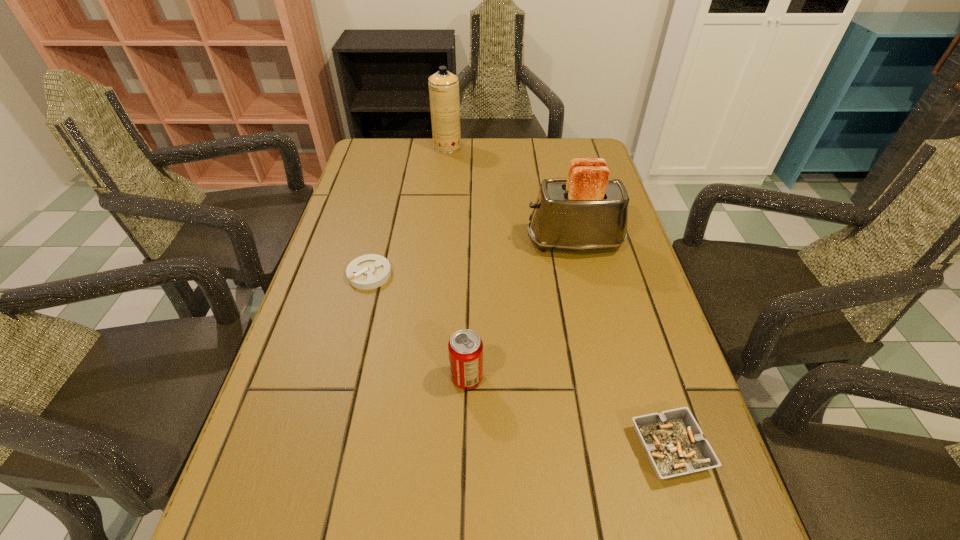
Find the location of `free region at the far edge of the desktop`. free region at the far edge of the desktop is located at coordinates (462, 150).

Image resolution: width=960 pixels, height=540 pixels. In the image, there is a desktop. In order to click on vacant space at the left edge in this screenshot , I will do `click(296, 401)`.

Find the location of a particular element. vacant space at the right edge of the desktop is located at coordinates (678, 510).

Identify the location of free location at the far right corner of the desktop. (585, 154).

Find the location of a particular element. empty space that is in between the aerosol can and the toaster is located at coordinates (511, 194).

Identify the location of free space between the nearer ashtray and the toaster. (622, 346).

Image resolution: width=960 pixels, height=540 pixels. I want to click on vacant space that's between the shortest object and the soda can, so click(x=419, y=326).

Find the location of a particular element. The image size is (960, 540). vacant point located between the right ashtray and the third tallest object is located at coordinates (568, 413).

Where is `blank region between the third object from left to right and the right ashtray`? This screenshot has width=960, height=540. blank region between the third object from left to right and the right ashtray is located at coordinates (568, 413).

Locate an element on the screen. The width and height of the screenshot is (960, 540). free space that is in between the farthest object and the nearest object is located at coordinates (559, 298).